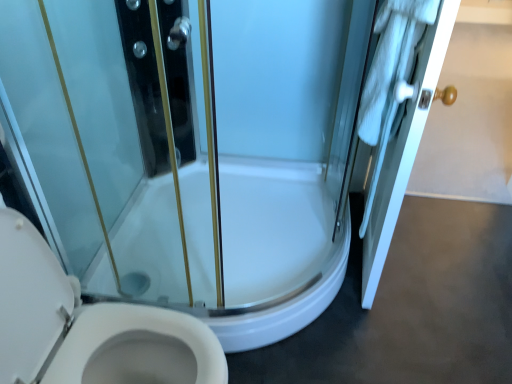
Question: Should I look upward or downward to see white wood door at right?

Choices:
 (A) down
 (B) up

Answer: (B)

Question: Should I look upward or downward to see white glossy toilet at lower left?

Choices:
 (A) up
 (B) down

Answer: (B)

Question: Is white wood door at right thinner than white glossy toilet at lower left?

Choices:
 (A) no
 (B) yes

Answer: (B)

Question: Is white wood door at right completely or partially outside of white glossy toilet at lower left?

Choices:
 (A) no
 (B) yes

Answer: (B)

Question: From the image's perspective, is white wood door at right beneath white glossy toilet at lower left?

Choices:
 (A) no
 (B) yes

Answer: (A)

Question: Could you tell me if white wood door at right is turned towards white glossy toilet at lower left?

Choices:
 (A) yes
 (B) no

Answer: (B)

Question: From a real-world perspective, is white wood door at right below white glossy toilet at lower left?

Choices:
 (A) yes
 (B) no

Answer: (B)

Question: From the image's perspective, is white wood door at right over white glossy toilet at lower left?

Choices:
 (A) no
 (B) yes

Answer: (B)

Question: From a real-world perspective, is white glossy toilet at lower left on white wood door at right?

Choices:
 (A) yes
 (B) no

Answer: (B)

Question: Is the position of white glossy toilet at lower left less distant than that of white wood door at right?

Choices:
 (A) yes
 (B) no

Answer: (A)

Question: Is white glossy toilet at lower left taller than white wood door at right?

Choices:
 (A) yes
 (B) no

Answer: (B)

Question: Is white glossy toilet at lower left in contact with white wood door at right?

Choices:
 (A) no
 (B) yes

Answer: (A)

Question: Considering the relative sizes of white glossy toilet at lower left and white wood door at right in the image provided, is white glossy toilet at lower left thinner than white wood door at right?

Choices:
 (A) yes
 (B) no

Answer: (B)

Question: Can you confirm if white glossy toilet at lower left is positioned to the left of white wood door at right?

Choices:
 (A) yes
 (B) no

Answer: (A)

Question: Does point (197, 349) appear closer or farther from the camera than point (398, 163)?

Choices:
 (A) farther
 (B) closer

Answer: (B)